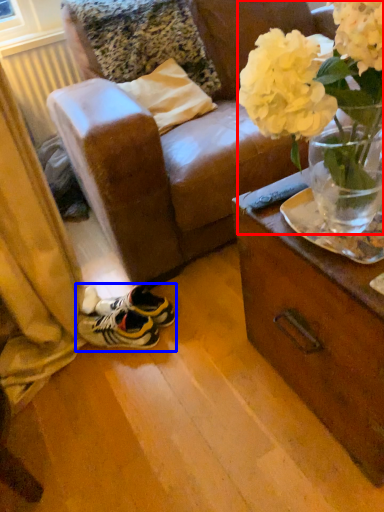
Question: Which object appears closest to the camera in this image, floral arrangement (highlighted by a red box) or footwear (highlighted by a blue box)?

Choices:
 (A) floral arrangement
 (B) footwear

Answer: (A)